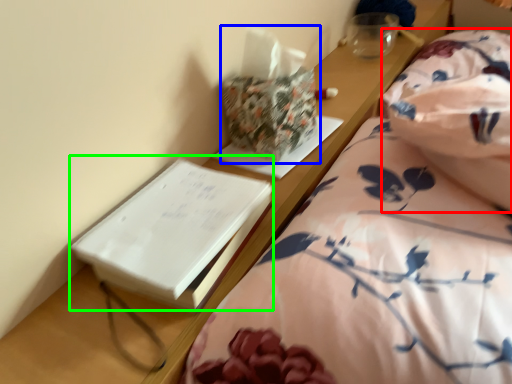
Question: Estimate the real-world distances between objects in this image. Which object is closer to blanket (highlighted by a red box), package (highlighted by a blue box) or paperback book (highlighted by a green box)?

Choices:
 (A) package
 (B) paperback book

Answer: (A)